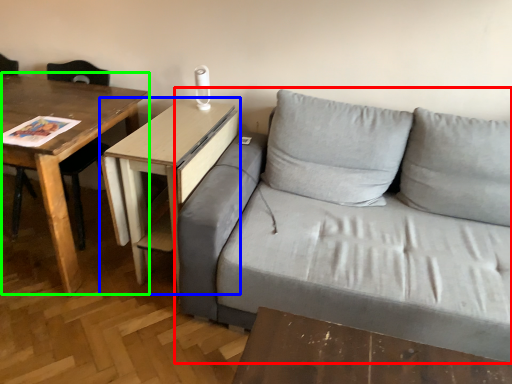
Question: Based on their relative distances, which object is farther from studio couch (highlighted by a red box)? Choose from table (highlighted by a blue box) and table (highlighted by a green box).

Choices:
 (A) table
 (B) table

Answer: (B)